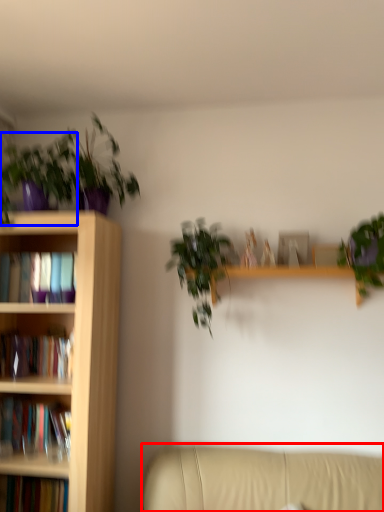
Question: Which point is closer to the camera, studio couch (highlighted by a red box) or houseplant (highlighted by a blue box)?

Choices:
 (A) studio couch
 (B) houseplant

Answer: (A)